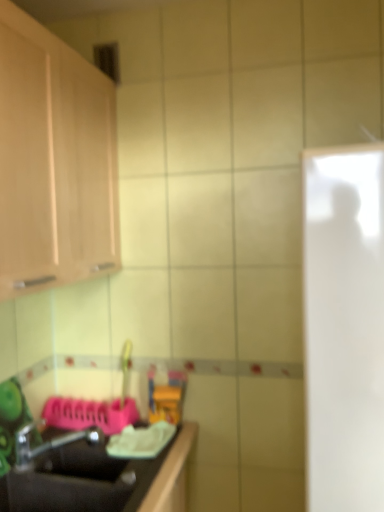
Image resolution: width=384 pixels, height=512 pixels. In order to click on free space behind metallic silver faucet at lower left in this screenshot , I will do `click(81, 439)`.